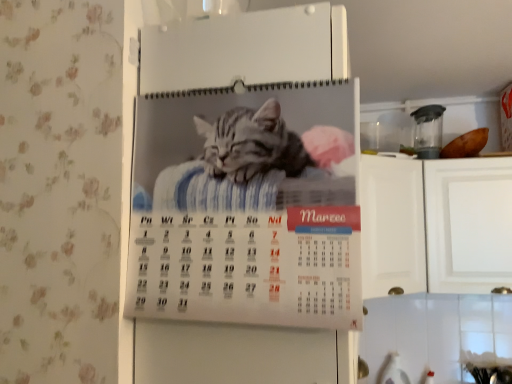
Question: From the image's perspective, is white glossy calendar at center, which ranks as the 2th appliance in top-to-bottom order, located above or below transparent plastic blender at upper right, arranged as the 2th appliance when ordered from the bottom?

Choices:
 (A) below
 (B) above

Answer: (A)

Question: Does point pyautogui.click(x=132, y=52) appear closer or farther from the camera than point pyautogui.click(x=420, y=140)?

Choices:
 (A) farther
 (B) closer

Answer: (B)

Question: Would you say white glossy calendar at center, which is the 2th appliance in back-to-front order, is inside or outside transparent plastic blender at upper right, which ranks as the first appliance in right-to-left order?

Choices:
 (A) outside
 (B) inside

Answer: (A)

Question: Is transparent plastic blender at upper right, which ranks as the first appliance in right-to-left order, wider or thinner than white glossy calendar at center, which ranks as the first appliance in bottom-to-top order?

Choices:
 (A) thin
 (B) wide

Answer: (A)

Question: Is transparent plastic blender at upper right, the 1th appliance from the back, inside or outside of white glossy calendar at center, which is the 2th appliance in back-to-front order?

Choices:
 (A) inside
 (B) outside

Answer: (B)

Question: Considering their positions, is transparent plastic blender at upper right, which appears as the 2th appliance when viewed from the front, located in front of or behind white glossy calendar at center, which is the 2th appliance in back-to-front order?

Choices:
 (A) behind
 (B) front

Answer: (A)

Question: Considering the positions of transparent plastic blender at upper right, which appears as the 2th appliance when viewed from the front, and white glossy calendar at center, which appears as the second appliance when viewed from the right, in the image, is transparent plastic blender at upper right, which appears as the 2th appliance when viewed from the front, taller or shorter than white glossy calendar at center, which appears as the second appliance when viewed from the right,?

Choices:
 (A) short
 (B) tall

Answer: (A)